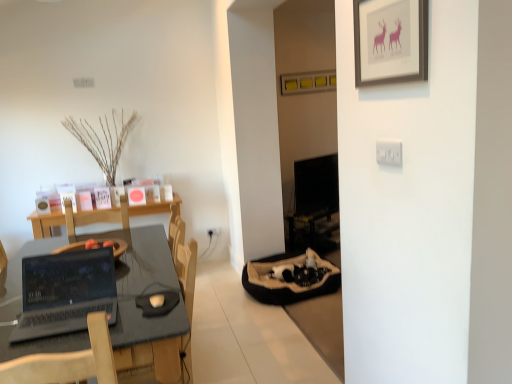
Question: Relative to silver metallic laptop at lower left, is matte black desk at left in front or behind?

Choices:
 (A) behind
 (B) front

Answer: (B)

Question: Is matte black desk at left spatially inside silver metallic laptop at lower left, or outside of it?

Choices:
 (A) inside
 (B) outside

Answer: (B)

Question: Based on their relative distances, which object is farther from the matte black desk at left?

Choices:
 (A) white plastic electric outlet at center
 (B) white plastic light switch at upper right
 (C) brown suede pet bed at lower right
 (D) matte pink deer picture frame at upper right
 (E) black glossy monitor at center

Answer: (E)

Question: Based on their relative distances, which object is farther from the white plastic light switch at upper right?

Choices:
 (A) black glossy monitor at center
 (B) silver metallic laptop at lower left
 (C) brown suede pet bed at lower right
 (D) matte black desk at left
 (E) matte pink deer picture frame at upper right

Answer: (A)